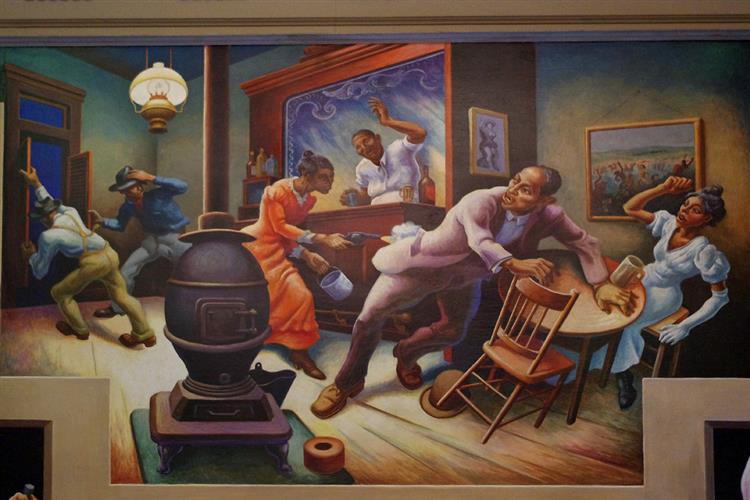
You are a GUI agent. You are given a task and a screenshot of the screen. Output one action in this format:
    pyautogui.click(x=<x>, y=<y>)
    Task: Click on the painting
    The image size is (750, 500).
    Given the screenshot: What is the action you would take?
    pyautogui.click(x=610, y=170)